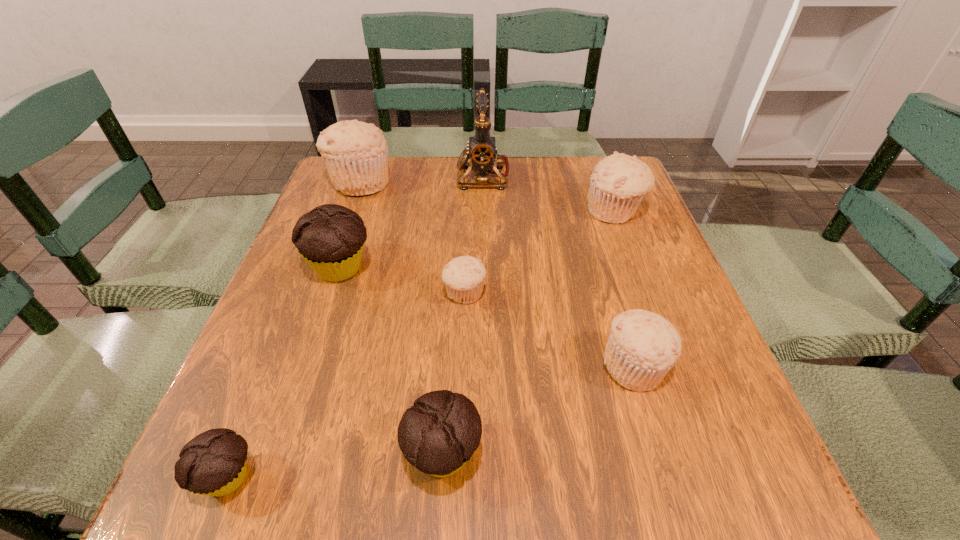
Find the location of a particular element. The image size is (960, 540). the sixth closest object relative to the farthest chocolate muffin is located at coordinates (642, 347).

Identify which muffin is located as the fifth nearest to the farthest chocolate muffin. Please provide its 2D coordinates. Your answer should be formatted as a tuple, i.e. [(x, y)], where the tuple contains the x and y coordinates of a point satisfying the conditions above.

[(642, 347)]

Point out which muffin is positioned as the second nearest to the third biggest beige muffin. Please provide its 2D coordinates. Your answer should be formatted as a tuple, i.e. [(x, y)], where the tuple contains the x and y coordinates of a point satisfying the conditions above.

[(463, 276)]

This screenshot has width=960, height=540. I want to click on beige muffin that is the closest to the seventh shortest object, so click(x=463, y=276).

Where is `the third closest beige muffin to the biggest beige muffin`? the third closest beige muffin to the biggest beige muffin is located at coordinates (642, 347).

Locate an element on the screen. This screenshot has height=540, width=960. chocolate muffin that can be found as the second closest to the third smallest beige muffin is located at coordinates (438, 435).

At what (x,y) coordinates should I click in order to perform the action: click on chocolate muffin that stands as the closest to the biggest chocolate muffin. Please return your answer as a coordinate pair (x, y). The image size is (960, 540). Looking at the image, I should click on (438, 435).

Where is `free region that satisfies the following two spatial constraints: 1. on the front side of the nearest beige muffin; 2. on the left side of the third beige muffin from right to left`? free region that satisfies the following two spatial constraints: 1. on the front side of the nearest beige muffin; 2. on the left side of the third beige muffin from right to left is located at coordinates (462, 367).

You are a GUI agent. You are given a task and a screenshot of the screen. Output one action in this format:
    pyautogui.click(x=<x>, y=<y>)
    Task: Click on the blank area in the image that satisfies the following two spatial constraints: 1. on the back side of the rightmost chocolate muffin; 2. on the left side of the third nearest object
    
    Given the screenshot: What is the action you would take?
    pyautogui.click(x=448, y=367)

Where is `free spot that satisfies the following two spatial constraints: 1. on the back side of the third smallest beige muffin; 2. on the left side of the third nearest muffin`? The image size is (960, 540). free spot that satisfies the following two spatial constraints: 1. on the back side of the third smallest beige muffin; 2. on the left side of the third nearest muffin is located at coordinates (588, 211).